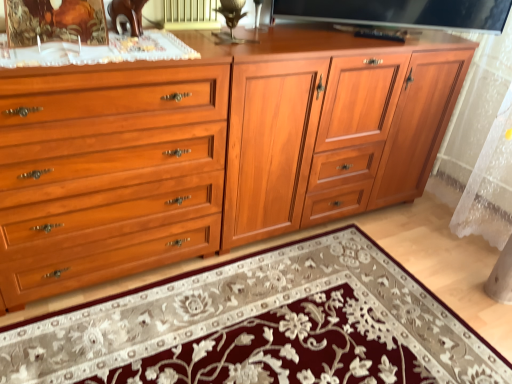
Question: Considering the relative sizes of matte wood cabinet at center and embroidered wool mat at center in the image provided, is matte wood cabinet at center smaller than embroidered wool mat at center?

Choices:
 (A) yes
 (B) no

Answer: (B)

Question: Is matte wood cabinet at center facing away from embroidered wool mat at center?

Choices:
 (A) yes
 (B) no

Answer: (B)

Question: Does matte wood cabinet at center appear on the left side of embroidered wool mat at center?

Choices:
 (A) no
 (B) yes

Answer: (A)

Question: Is matte wood cabinet at center to the right of embroidered wool mat at center from the viewer's perspective?

Choices:
 (A) yes
 (B) no

Answer: (A)

Question: Is matte wood cabinet at center positioned far away from embroidered wool mat at center?

Choices:
 (A) yes
 (B) no

Answer: (B)

Question: Does point (216, 11) appear closer or farther from the camera than point (250, 119)?

Choices:
 (A) farther
 (B) closer

Answer: (A)

Question: Is matte gold radiator at upper center to the left or to the right of matte wood cabinet at center in the image?

Choices:
 (A) left
 (B) right

Answer: (A)

Question: Considering their positions, is matte gold radiator at upper center located in front of or behind matte wood cabinet at center?

Choices:
 (A) front
 (B) behind

Answer: (B)

Question: From a real-world perspective, is matte gold radiator at upper center above or below matte wood cabinet at center?

Choices:
 (A) below
 (B) above

Answer: (B)

Question: From a real-world perspective, is matte wood cabinet at center positioned above or below matte wood chest of drawers at left?

Choices:
 (A) above
 (B) below

Answer: (B)

Question: Based on their sizes in the image, would you say matte wood cabinet at center is bigger or smaller than matte wood chest of drawers at left?

Choices:
 (A) small
 (B) big

Answer: (B)

Question: Relative to matte wood chest of drawers at left, is matte wood cabinet at center in front or behind?

Choices:
 (A) front
 (B) behind

Answer: (B)

Question: Is point (433, 100) positioned closer to the camera than point (163, 107)?

Choices:
 (A) farther
 (B) closer

Answer: (A)

Question: Do you think satin black tv at upper center is within matte wood chest of drawers at left, or outside of it?

Choices:
 (A) outside
 (B) inside

Answer: (A)

Question: Based on their positions, is satin black tv at upper center located to the left or right of matte wood chest of drawers at left?

Choices:
 (A) right
 (B) left

Answer: (A)